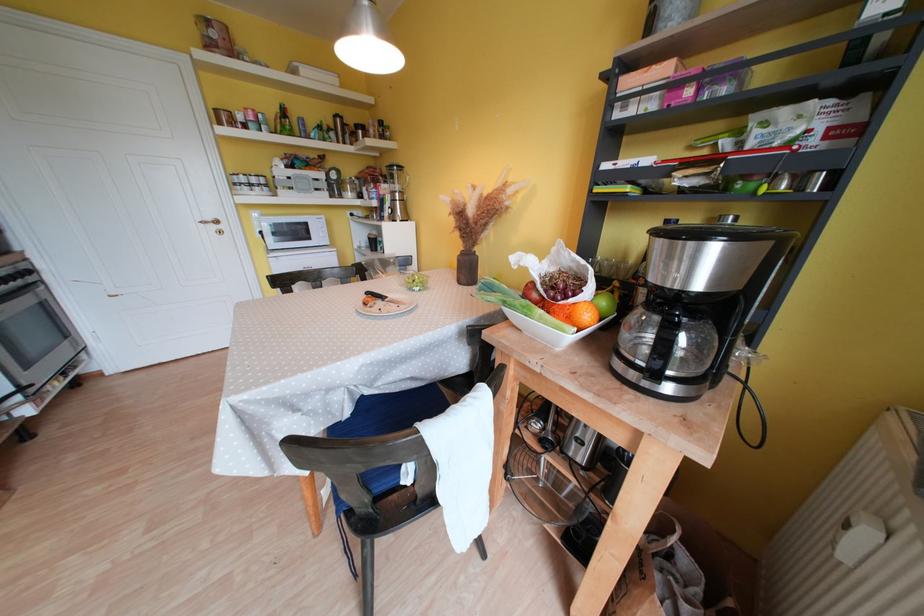
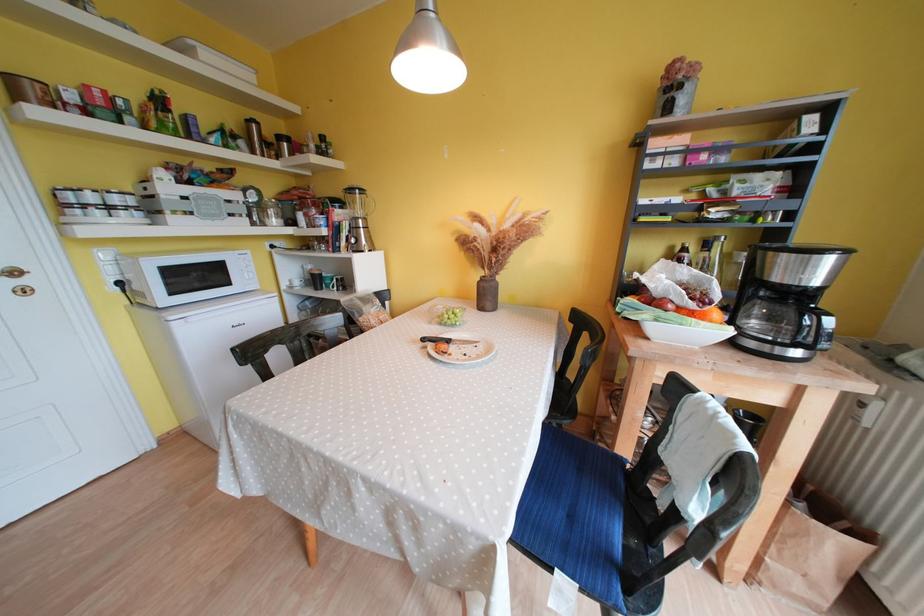
Question: The images are taken continuously from a first-person perspective. In which direction is your viewpoint rotating?

Choices:
 (A) Left
 (B) Right
 (C) Up
 (D) Down

Answer: (B)